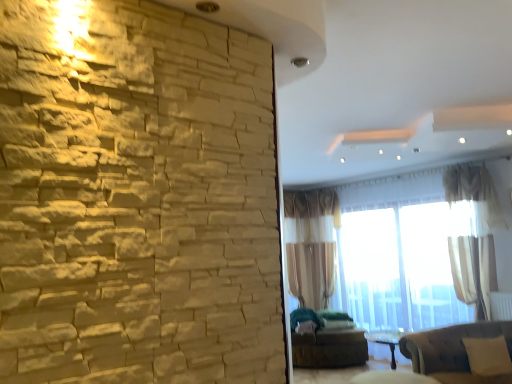
The image size is (512, 384). Describe the element at coordinates (397, 250) in the screenshot. I see `translucent fabric window at center` at that location.

Where is `beige fabric pillow at lower right`? beige fabric pillow at lower right is located at coordinates (488, 356).

The height and width of the screenshot is (384, 512). What do you see at coordinates (472, 234) in the screenshot? I see `white sheer curtain at upper right, marked as the 1th curtain in a front-to-back arrangement` at bounding box center [472, 234].

What are the coordinates of `white plastic radiator at lower right` in the screenshot? It's located at (501, 306).

This screenshot has width=512, height=384. Find the location of `velvet brown couch at lower right`. velvet brown couch at lower right is located at coordinates (453, 351).

Considering the points (426, 326) and (505, 305), which point is in front, point (426, 326) or point (505, 305)?

Point (505, 305)

Between translucent fabric window at center and white plastic radiator at lower right, which one has larger size?

With larger size is translucent fabric window at center.

Where is `radiator that is below the translucent fabric window at center (from the image's perspective)`? Image resolution: width=512 pixels, height=384 pixels. radiator that is below the translucent fabric window at center (from the image's perspective) is located at coordinates (501, 306).

Is translucent fabric window at center taller than white plastic radiator at lower right?

Correct, translucent fabric window at center is much taller as white plastic radiator at lower right.

Is sheer beige curtain at center, the 1th curtain positioned from the left, in contact with velvet brown couch at lower right?

No, sheer beige curtain at center, the 1th curtain positioned from the left, is not next to velvet brown couch at lower right.

Is sheer beige curtain at center, the 2th curtain in the front-to-back sequence, aimed at velvet brown couch at lower right?

No.

How different are the orientations of sheer beige curtain at center, the 1th curtain positioned from the left, and velvet brown couch at lower right in degrees?

4.62 degrees.

Is point (322, 194) farther from viewer compared to point (499, 376)?

Yes.

Identify the location of futon below the beige fabric pillow at lower right (from a real-world perspective). (326, 342).

Is point (488, 357) positioned before point (362, 359)?

Yes, point (488, 357) is in front of point (362, 359).

Can you confirm if beige fabric pillow at lower right is thinner than brown fabric futon at lower center?

Yes, beige fabric pillow at lower right is thinner than brown fabric futon at lower center.

Can you tell me how much white sheer curtain at upper right, marked as the 2th curtain in a back-to-front arrangement, and sheer beige curtain at center, the 2th curtain in the front-to-back sequence, differ in facing direction?

0.000591 degrees separate the facing orientations of white sheer curtain at upper right, marked as the 2th curtain in a back-to-front arrangement, and sheer beige curtain at center, the 2th curtain in the front-to-back sequence.

Are white sheer curtain at upper right, marked as the 2th curtain in a back-to-front arrangement, and sheer beige curtain at center, which ranks as the 1th curtain in back-to-front order, located far from each other?

Indeed, white sheer curtain at upper right, marked as the 2th curtain in a back-to-front arrangement, is not near sheer beige curtain at center, which ranks as the 1th curtain in back-to-front order.

Based on the photo, which of these two, white sheer curtain at upper right, marked as the 1th curtain in a front-to-back arrangement, or sheer beige curtain at center, which appears as the 2th curtain when viewed from the right, stands shorter?

white sheer curtain at upper right, marked as the 1th curtain in a front-to-back arrangement.

From the image's perspective, which one is positioned higher, white sheer curtain at upper right, marked as the 1th curtain in a front-to-back arrangement, or sheer beige curtain at center, which ranks as the 1th curtain in back-to-front order?

white sheer curtain at upper right, marked as the 1th curtain in a front-to-back arrangement, appears higher in the image.

Would you consider sheer beige curtain at center, the 1th curtain positioned from the left, to be distant from brown fabric futon at lower center?

sheer beige curtain at center, the 1th curtain positioned from the left, is positioned a significant distance from brown fabric futon at lower center.

Does sheer beige curtain at center, the 1th curtain positioned from the left, turn towards brown fabric futon at lower center?

No, sheer beige curtain at center, the 1th curtain positioned from the left, is not aimed at brown fabric futon at lower center.

Measure the distance between sheer beige curtain at center, the 1th curtain positioned from the left, and brown fabric futon at lower center.

sheer beige curtain at center, the 1th curtain positioned from the left, is 3.57 feet from brown fabric futon at lower center.

From a real-world perspective, who is located lower, sheer beige curtain at center, which appears as the 2th curtain when viewed from the right, or brown fabric futon at lower center?

In real-world perspective, brown fabric futon at lower center is lower.

Does white plastic radiator at lower right turn towards white sheer curtain at upper right, marked as the 1th curtain in a right-to-left arrangement?

Yes, white plastic radiator at lower right is oriented towards white sheer curtain at upper right, marked as the 1th curtain in a right-to-left arrangement.

From the image's perspective, does white plastic radiator at lower right appear higher than white sheer curtain at upper right, marked as the 1th curtain in a right-to-left arrangement?

Actually, white plastic radiator at lower right appears below white sheer curtain at upper right, marked as the 1th curtain in a right-to-left arrangement, in the image.

Measure the distance between white plastic radiator at lower right and white sheer curtain at upper right, marked as the 2th curtain in a left-to-right arrangement.

The distance of white plastic radiator at lower right from white sheer curtain at upper right, marked as the 2th curtain in a left-to-right arrangement, is 27.28 inches.

Which of these two, white plastic radiator at lower right or white sheer curtain at upper right, marked as the 2th curtain in a back-to-front arrangement, stands shorter?

Standing shorter between the two is white plastic radiator at lower right.

Is white sheer curtain at upper right, marked as the 2th curtain in a left-to-right arrangement, further to the viewer compared to white plastic radiator at lower right?

No, the depth of white sheer curtain at upper right, marked as the 2th curtain in a left-to-right arrangement, is less than that of white plastic radiator at lower right.

Is white sheer curtain at upper right, marked as the 1th curtain in a right-to-left arrangement, wider than white plastic radiator at lower right?

Yes.

Does point (485, 212) appear closer or farther from the camera than point (495, 300)?

Point (485, 212).

Find the location of a particular element. This screenshot has height=384, width=512. window on the left of white plastic radiator at lower right is located at coordinates (397, 250).

You are a GUI agent. You are given a task and a screenshot of the screen. Output one action in this format:
    pyautogui.click(x=<x>, y=<y>)
    Task: Click on the studio couch below the sheer beige curtain at center, which ranks as the 1th curtain in back-to-front order (from a real-world perspective)
    This screenshot has height=384, width=512.
    Given the screenshot: What is the action you would take?
    pyautogui.click(x=453, y=351)

When comparing their distances from brown fabric futon at lower center, does white plastic radiator at lower right or beige fabric pillow at lower right seem closer?

beige fabric pillow at lower right lies closer to brown fabric futon at lower center than the other object.

Looking at the image, which one is located closer to sheer beige curtain at center, which ranks as the 1th curtain in back-to-front order, velvet brown couch at lower right or white sheer curtain at upper right, marked as the 1th curtain in a front-to-back arrangement?

white sheer curtain at upper right, marked as the 1th curtain in a front-to-back arrangement.

Consider the image. When comparing their distances from beige fabric pillow at lower right, does white sheer curtain at upper right, marked as the 1th curtain in a right-to-left arrangement, or sheer beige curtain at center, the 1th curtain positioned from the left, seem further?

sheer beige curtain at center, the 1th curtain positioned from the left, lies further to beige fabric pillow at lower right than the other object.

Considering their positions, is white plastic radiator at lower right positioned further to velvet brown couch at lower right than translucent fabric window at center?

translucent fabric window at center lies further to velvet brown couch at lower right than the other object.

Looking at the image, which one is located closer to white sheer curtain at upper right, marked as the 2th curtain in a left-to-right arrangement, brown fabric futon at lower center or translucent fabric window at center?

translucent fabric window at center.

Based on their spatial positions, is white sheer curtain at upper right, marked as the 1th curtain in a right-to-left arrangement, or translucent fabric window at center further from sheer beige curtain at center, which appears as the 2th curtain when viewed from the right?

The object further to sheer beige curtain at center, which appears as the 2th curtain when viewed from the right, is white sheer curtain at upper right, marked as the 1th curtain in a right-to-left arrangement.

From the image, which object appears to be farther from sheer beige curtain at center, which appears as the 2th curtain when viewed from the right, beige fabric pillow at lower right or white sheer curtain at upper right, marked as the 2th curtain in a left-to-right arrangement?

beige fabric pillow at lower right is further to sheer beige curtain at center, which appears as the 2th curtain when viewed from the right.

Estimate the real-world distances between objects in this image. Which object is further from velvet brown couch at lower right, white sheer curtain at upper right, marked as the 1th curtain in a right-to-left arrangement, or white plastic radiator at lower right?

Among the two, white sheer curtain at upper right, marked as the 1th curtain in a right-to-left arrangement, is located further to velvet brown couch at lower right.

You are a GUI agent. You are given a task and a screenshot of the screen. Output one action in this format:
    pyautogui.click(x=<x>, y=<y>)
    Task: Click on the window between beige fabric pillow at lower right and brown fabric futon at lower center in the front-back direction
    Image resolution: width=512 pixels, height=384 pixels.
    Given the screenshot: What is the action you would take?
    pyautogui.click(x=397, y=250)

The height and width of the screenshot is (384, 512). I want to click on pillow positioned between velvet brown couch at lower right and translucent fabric window at center from near to far, so click(488, 356).

Identify the location of curtain positioned between velvet brown couch at lower right and sheer beige curtain at center, which appears as the 2th curtain when viewed from the right, from near to far. (472, 234).

Locate an element on the screen. The image size is (512, 384). pillow between velvet brown couch at lower right and sheer beige curtain at center, which ranks as the 1th curtain in back-to-front order, in the front-back direction is located at coordinates (488, 356).